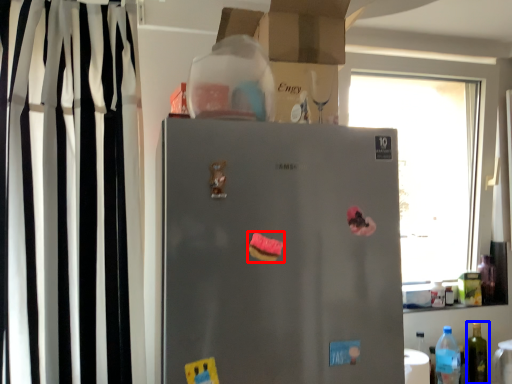
Question: Which object is further to the camera taking this photo, stuff (highlighted by a red box) or bottle (highlighted by a blue box)?

Choices:
 (A) stuff
 (B) bottle

Answer: (B)